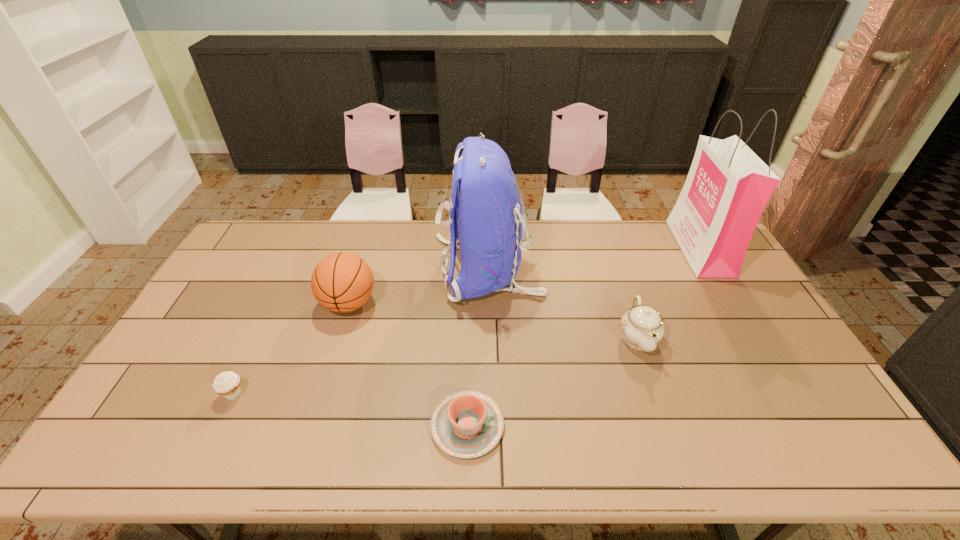
Locate an element on the screen. The image size is (960, 540). blank region between the fourth tallest object and the fifth object from right to left is located at coordinates (493, 320).

The height and width of the screenshot is (540, 960). Find the location of `free area in between the rightmost object and the right chinaware`. free area in between the rightmost object and the right chinaware is located at coordinates (668, 293).

Find the location of `vacant space that is in between the second object from left to right and the backpack`. vacant space that is in between the second object from left to right and the backpack is located at coordinates (419, 286).

Locate an element on the screen. The height and width of the screenshot is (540, 960). vacant area that lies between the backpack and the farther chinaware is located at coordinates (563, 303).

Where is `vacant area between the backpack and the basketball`? This screenshot has height=540, width=960. vacant area between the backpack and the basketball is located at coordinates click(419, 286).

Find the location of a particular element. The height and width of the screenshot is (540, 960). free spot between the backpack and the basketball is located at coordinates [x=419, y=286].

In order to click on vacant space in between the rightmost object and the fourth shortest object in this screenshot , I will do `click(524, 276)`.

This screenshot has width=960, height=540. What are the coordinates of `free space between the nearer chinaware and the rightmost object` in the screenshot? It's located at point(584,337).

Find the location of a particular element. The image size is (960, 540). free spot between the backpack and the fifth object from right to left is located at coordinates (419, 286).

Identify which object is the closest to the muffin. Please provide its 2D coordinates. Your answer should be formatted as a tuple, i.e. [(x, y)], where the tuple contains the x and y coordinates of a point satisfying the conditions above.

[(341, 282)]